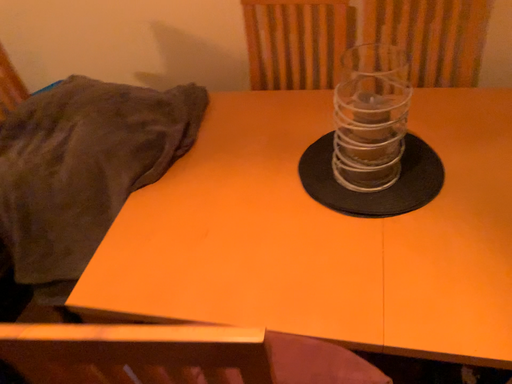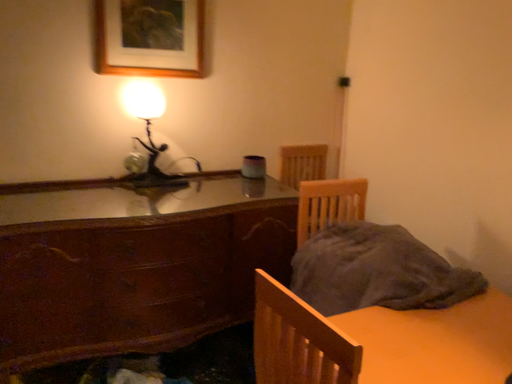
Question: Which way did the camera rotate in the video?

Choices:
 (A) rotated right
 (B) rotated left

Answer: (B)